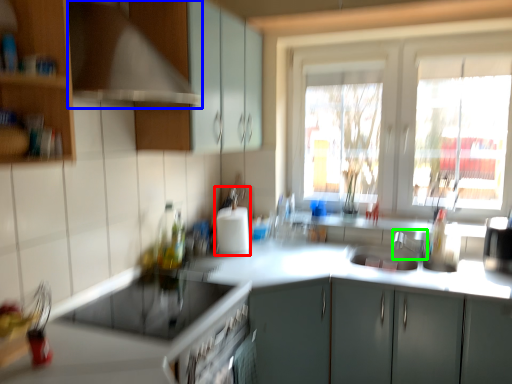
Question: Based on their relative distances, which object is farther from appliance (highlighted by a red box)? Choose from exhaust hood (highlighted by a blue box) and faucet (highlighted by a green box).

Choices:
 (A) exhaust hood
 (B) faucet

Answer: (A)